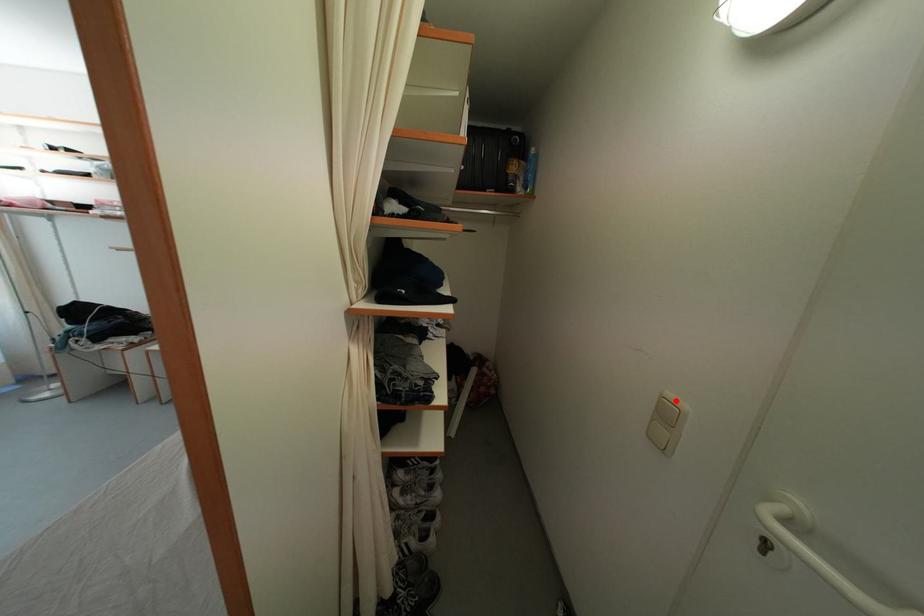
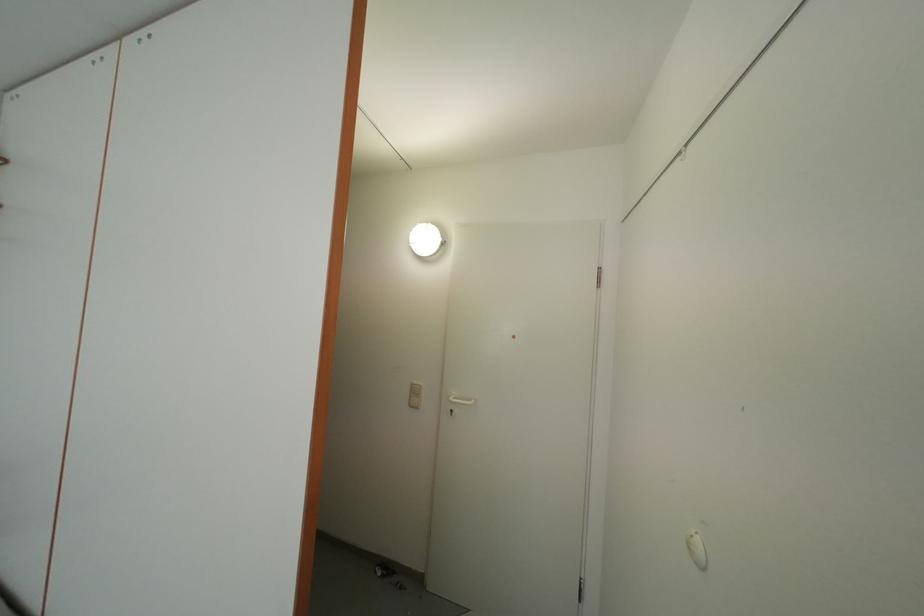
The point at the highlighted location is marked in the first image. Where is the corresponding point in the second image?

(420, 387)